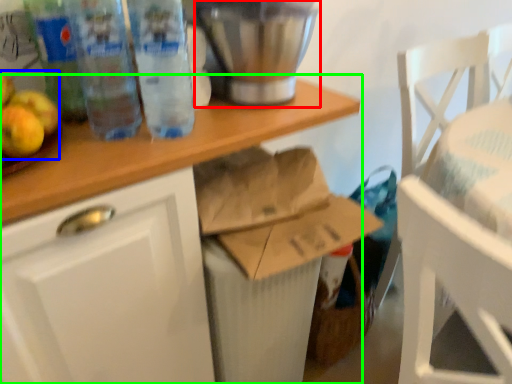
Question: Which object is the closest to the appliance (highlighted by a red box)? Choose among these: apple (highlighted by a blue box) or desk (highlighted by a green box).

Choices:
 (A) apple
 (B) desk

Answer: (B)